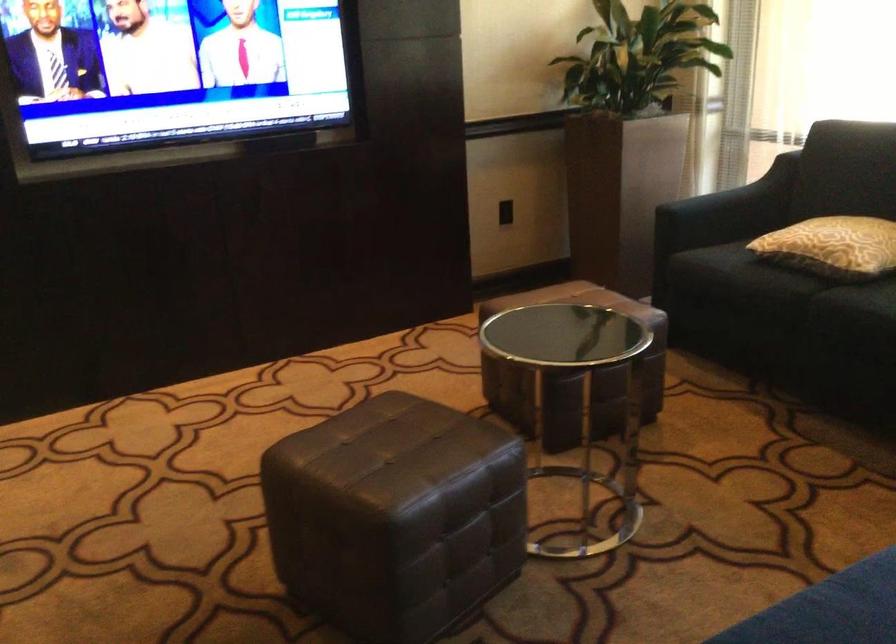
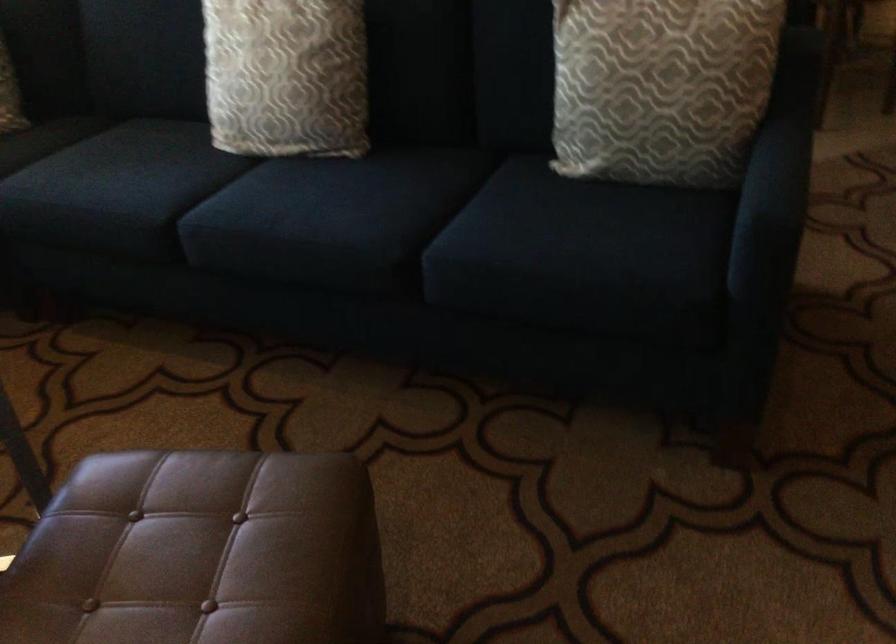
The point at (394, 516) is marked in the first image. Where is the corresponding point in the second image?

(341, 444)